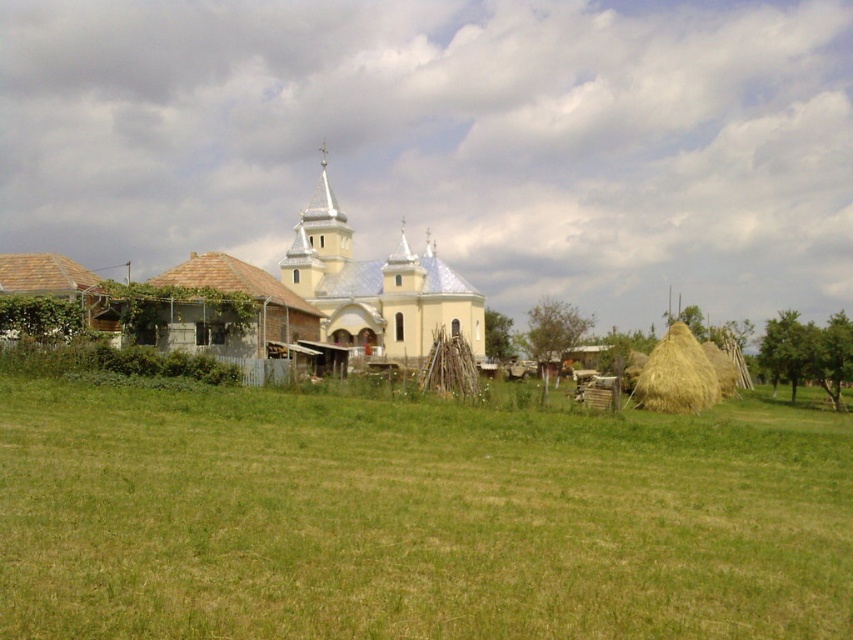
Question: Can you confirm if green grass at center is positioned above yellow metallic church at center?

Choices:
 (A) yes
 (B) no

Answer: (B)

Question: Can you confirm if yellow matte church at center is positioned below yellow metallic church at center?

Choices:
 (A) yes
 (B) no

Answer: (A)

Question: Estimate the real-world distances between objects in this image. Which object is farther from the yellow matte church at center?

Choices:
 (A) yellow metallic church at center
 (B) yellow straw stack at right

Answer: (B)

Question: Which of the following is the closest to the observer?

Choices:
 (A) (701, 385)
 (B) (316, 368)
 (C) (358, 300)

Answer: (A)

Question: Which object is positioned farthest from the yellow straw stack at right?

Choices:
 (A) green grass at center
 (B) yellow metallic church at center
 (C) brown shingled hut at lower left
 (D) yellow matte church at center

Answer: (C)

Question: Is yellow matte church at center bigger than yellow straw stack at right?

Choices:
 (A) no
 (B) yes

Answer: (B)